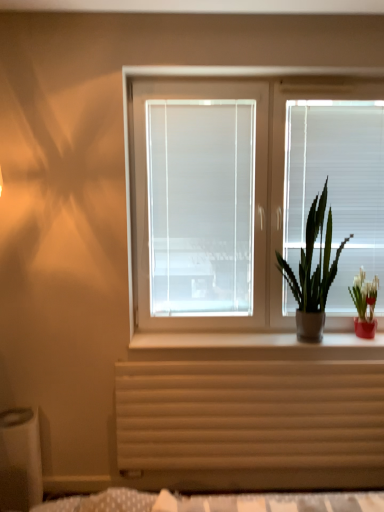
You are a GUI agent. You are given a task and a screenshot of the screen. Output one action in this format:
    pyautogui.click(x=<x>, y=<y>)
    Task: Click on the free space above white matte window sill at center (from a real-world perspective)
    
    Given the screenshot: What is the action you would take?
    pyautogui.click(x=237, y=340)